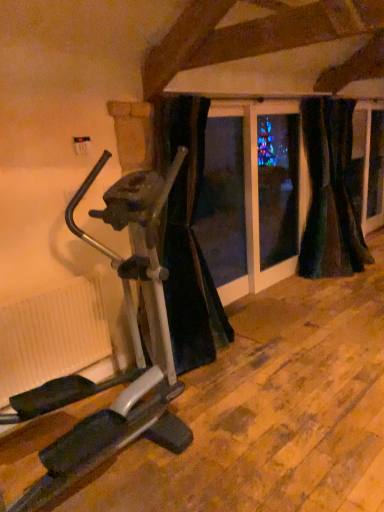
Question: Are velvet dark green curtain at right, positioned as the 1th curtain in right-to-left order, and velvet dark green curtain at right, acting as the second curtain starting from the left, beside each other?

Choices:
 (A) no
 (B) yes

Answer: (A)

Question: Considering the relative sizes of velvet dark green curtain at right, marked as the third curtain in a left-to-right arrangement, and velvet dark green curtain at right, acting as the second curtain starting from the left, in the image provided, is velvet dark green curtain at right, marked as the third curtain in a left-to-right arrangement, bigger than velvet dark green curtain at right, acting as the second curtain starting from the left,?

Choices:
 (A) no
 (B) yes

Answer: (A)

Question: Is velvet dark green curtain at right, marked as the third curtain in a left-to-right arrangement, not inside velvet dark green curtain at right, acting as the second curtain starting from the left?

Choices:
 (A) yes
 (B) no

Answer: (A)

Question: Is velvet dark green curtain at right, marked as the third curtain in a left-to-right arrangement, to the right of velvet dark green curtain at right, the 2th curtain positioned from the right, from the viewer's perspective?

Choices:
 (A) no
 (B) yes

Answer: (B)

Question: Considering the relative sizes of velvet dark green curtain at right, positioned as the 1th curtain in right-to-left order, and velvet dark green curtain at right, the 2th curtain positioned from the right, in the image provided, is velvet dark green curtain at right, positioned as the 1th curtain in right-to-left order, smaller than velvet dark green curtain at right, the 2th curtain positioned from the right,?

Choices:
 (A) yes
 (B) no

Answer: (A)

Question: Does velvet dark green curtain at right, positioned as the 1th curtain in right-to-left order, come behind velvet dark green curtain at right, the 2th curtain positioned from the right?

Choices:
 (A) yes
 (B) no

Answer: (A)

Question: Is velvet dark green curtain at right, marked as the third curtain in a left-to-right arrangement, bigger than white ribbed radiator at lower left?

Choices:
 (A) no
 (B) yes

Answer: (B)

Question: Does velvet dark green curtain at right, marked as the third curtain in a left-to-right arrangement, have a greater width compared to white ribbed radiator at lower left?

Choices:
 (A) yes
 (B) no

Answer: (A)

Question: From the image's perspective, does velvet dark green curtain at right, marked as the third curtain in a left-to-right arrangement, appear lower than white ribbed radiator at lower left?

Choices:
 (A) no
 (B) yes

Answer: (A)

Question: Is velvet dark green curtain at right, positioned as the 1th curtain in right-to-left order, to the right of white ribbed radiator at lower left from the viewer's perspective?

Choices:
 (A) yes
 (B) no

Answer: (A)

Question: Is velvet dark green curtain at right, marked as the third curtain in a left-to-right arrangement, further to the viewer compared to white ribbed radiator at lower left?

Choices:
 (A) no
 (B) yes

Answer: (B)

Question: Does velvet dark green curtain at right, positioned as the 1th curtain in right-to-left order, have a greater height compared to white ribbed radiator at lower left?

Choices:
 (A) yes
 (B) no

Answer: (A)

Question: Is velvet dark green curtain at right, positioned as the 1th curtain in right-to-left order, a part of white ribbed radiator at lower left?

Choices:
 (A) no
 (B) yes

Answer: (A)